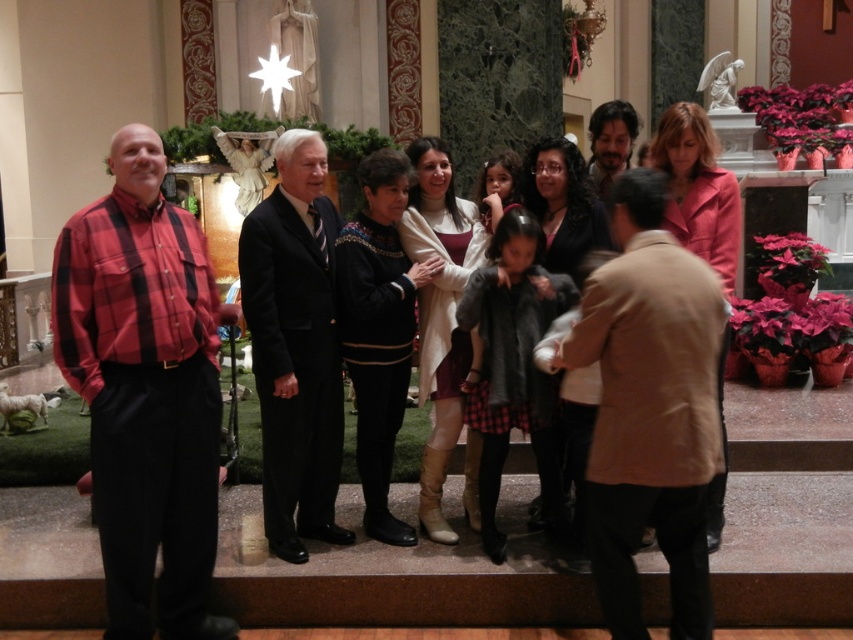
Is plaid cotton shirt at left bigger than dark suit at center?

No, plaid cotton shirt at left is not bigger than dark suit at center.

Who is taller, plaid cotton shirt at left or dark suit at center?

dark suit at center

You are a GUI agent. You are given a task and a screenshot of the screen. Output one action in this format:
    pyautogui.click(x=<x>, y=<y>)
    Task: Click on the plaid cotton shirt at left
    
    Given the screenshot: What is the action you would take?
    pyautogui.click(x=144, y=390)

Does point (488, 442) come farther from viewer compared to point (318, 348)?

No, (488, 442) is in front of (318, 348).

Is plaid shirt at left wider than dark suit at center?

Indeed, plaid shirt at left has a greater width compared to dark suit at center.

I want to click on plaid shirt at left, so click(532, 262).

Who is more forward, (x=83, y=250) or (x=289, y=189)?

Positioned in front is point (x=83, y=250).

Can you confirm if plaid cotton shirt at left is bigger than plaid shirt at left?

Incorrect, plaid cotton shirt at left is not larger than plaid shirt at left.

Where is `plaid cotton shirt at left`? plaid cotton shirt at left is located at coordinates (144, 390).